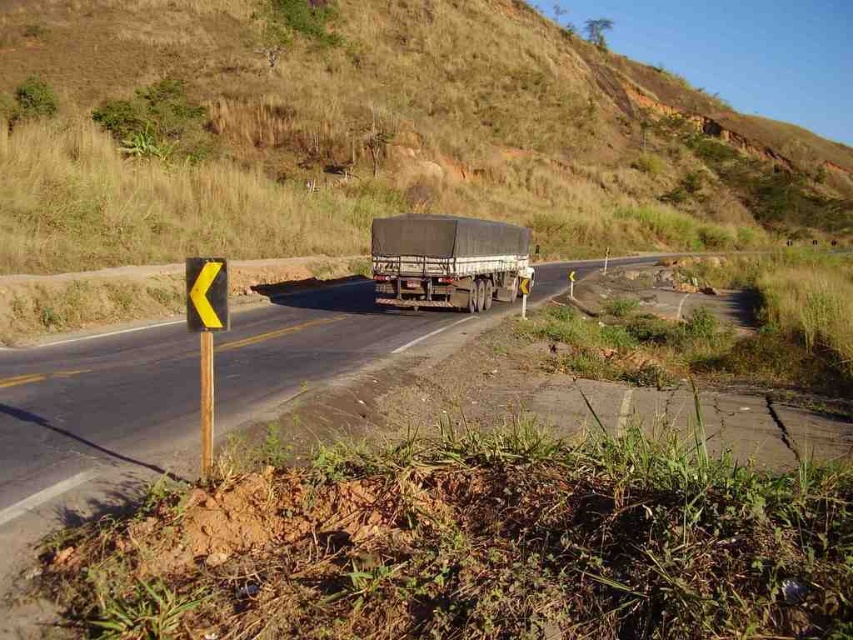
You are driving a car and see the dark gray matte trailer truck at center and the yellow plastic traffic sign at left. Which object is positioned higher in the image?

The dark gray matte trailer truck at center is positioned higher than the yellow plastic traffic sign at left in the image.

You are driving a car and see the dark gray matte trailer truck at center and the yellow plastic sign at left. According to the scene, which object is positioned more to the left?

The yellow plastic sign at left is positioned more to the left than the dark gray matte trailer truck at center.

You are a driver approaching the curve ahead. You notice the brown grassy hillside at upper center and the dark gray matte trailer truck at center. Which object is higher in elevation compared to the other?

The brown grassy hillside at upper center is taller than the dark gray matte trailer truck at center.